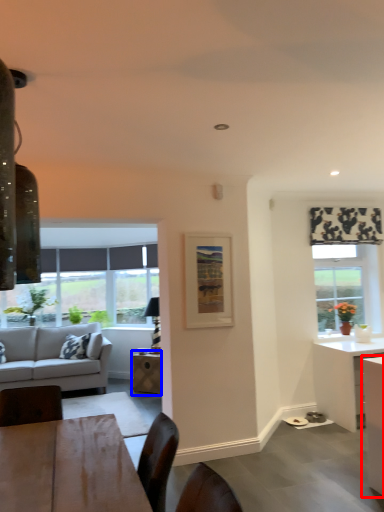
Question: Which of the following is the farthest to the observer, cabinetry (highlighted by a red box) or table (highlighted by a blue box)?

Choices:
 (A) cabinetry
 (B) table

Answer: (B)